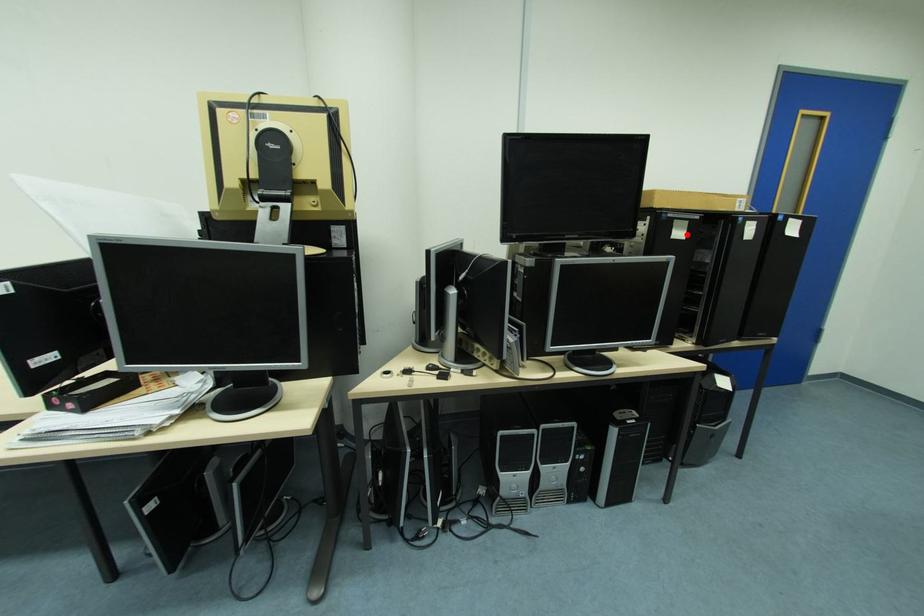
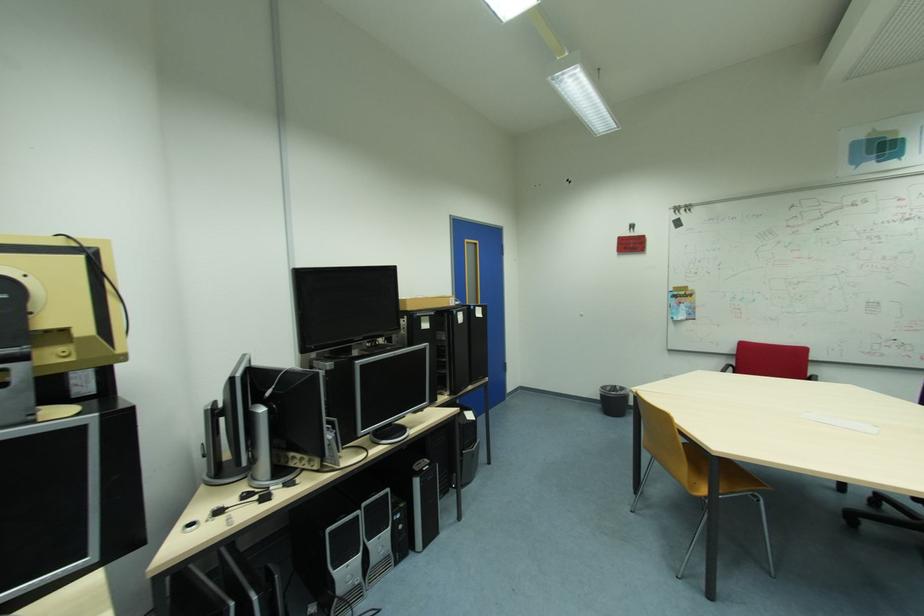
Locate, in the second image, the point that corresponds to the highlighted location in the first image.

(432, 326)